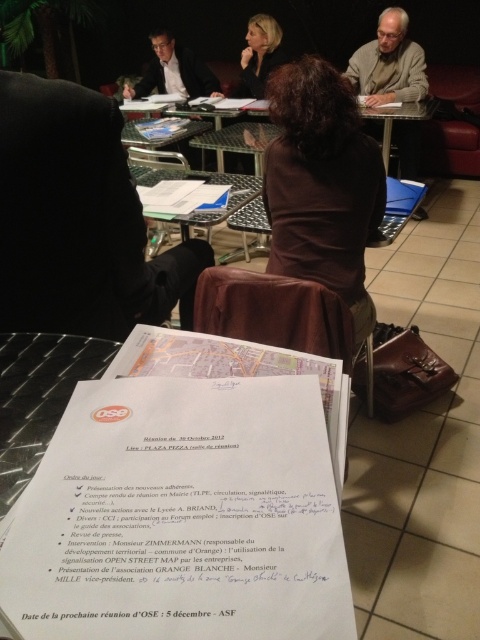
Question: Estimate the real-world distances between objects in this image. Which object is farther from the black fabric jacket at left?

Choices:
 (A) metallic silver table at center
 (B) white paper at center
 (C) brown fabric coat at center

Answer: (A)

Question: Is brown fabric coat at center wider than light beige sweater at upper right?

Choices:
 (A) yes
 (B) no

Answer: (B)

Question: Can you confirm if black fabric jacket at left is bigger than matte black suit at upper left?

Choices:
 (A) no
 (B) yes

Answer: (A)

Question: Is brown fabric coat at center positioned in front of blonde hair at center?

Choices:
 (A) no
 (B) yes

Answer: (B)

Question: Which is nearer to the matte black suit at upper left?

Choices:
 (A) metallic silver table at center
 (B) brown fabric coat at center

Answer: (A)

Question: Among these points, which one is farthest from the camera?

Choices:
 (A) (286, 74)
 (B) (176, 64)
 (C) (224, 572)

Answer: (B)